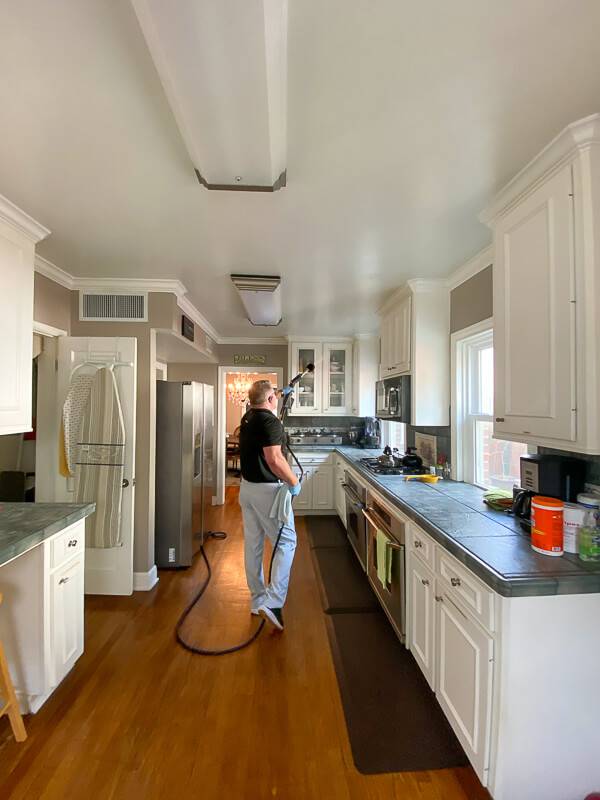
Where is `oven door handle`? The width and height of the screenshot is (600, 800). oven door handle is located at coordinates (356, 500), (375, 522).